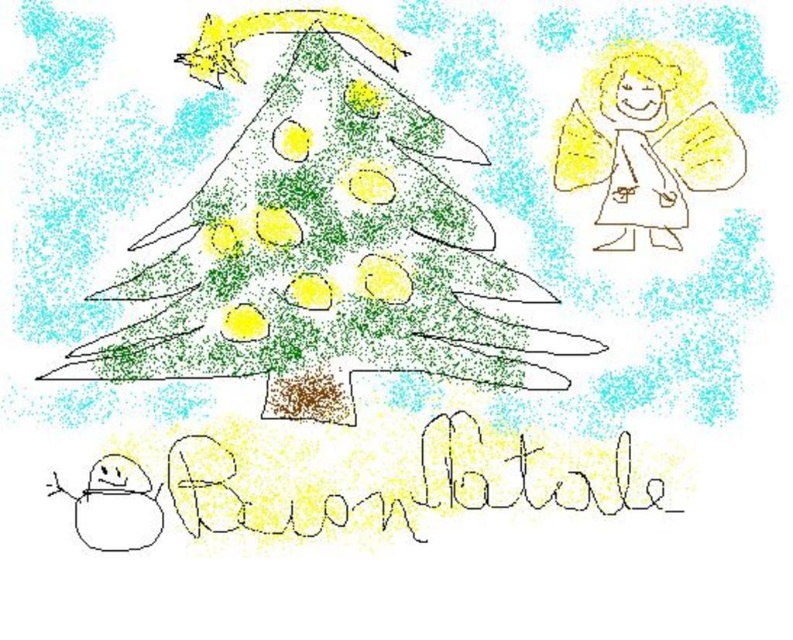
You are a child looking at the Christmas tree and the angel in the drawing. Which point, point 1 at (236, 237) or point 2 at (713, 172), is closer to you?

Point 1 at (236, 237) is closer to you because it is further to the camera than point 2 at (713, 172).

Consider the image. Based on the scene described, which object is wider when comparing the green textured christmas tree at center and the yellow paper angel at upper right?

The green textured christmas tree at center is wider than the yellow paper angel at upper right according to the description.